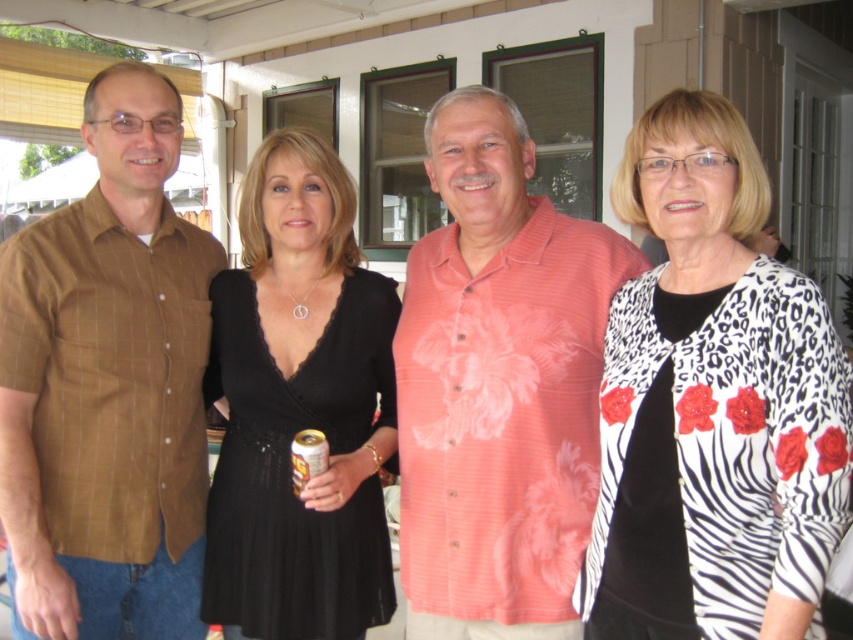
Question: Can you confirm if white zebra print cardigan at right is smaller than black satin dress at center?

Choices:
 (A) yes
 (B) no

Answer: (A)

Question: Which point is farther to the camera?

Choices:
 (A) (x=747, y=611)
 (B) (x=143, y=605)

Answer: (B)

Question: Can you confirm if brown plaid shirt at left is positioned to the left of gold metallic can at center?

Choices:
 (A) no
 (B) yes

Answer: (B)

Question: Is white zebra print cardigan at right further to camera compared to pink floral shirt at center?

Choices:
 (A) no
 (B) yes

Answer: (A)

Question: Which point is closer to the camera taking this photo?

Choices:
 (A) pos(310,465)
 (B) pos(791,404)
 (C) pos(381,324)
 (D) pos(83,237)

Answer: (B)

Question: Among these objects, which one is farthest from the camera?

Choices:
 (A) black satin dress at center
 (B) brown plaid shirt at left
 (C) white zebra print cardigan at right

Answer: (B)